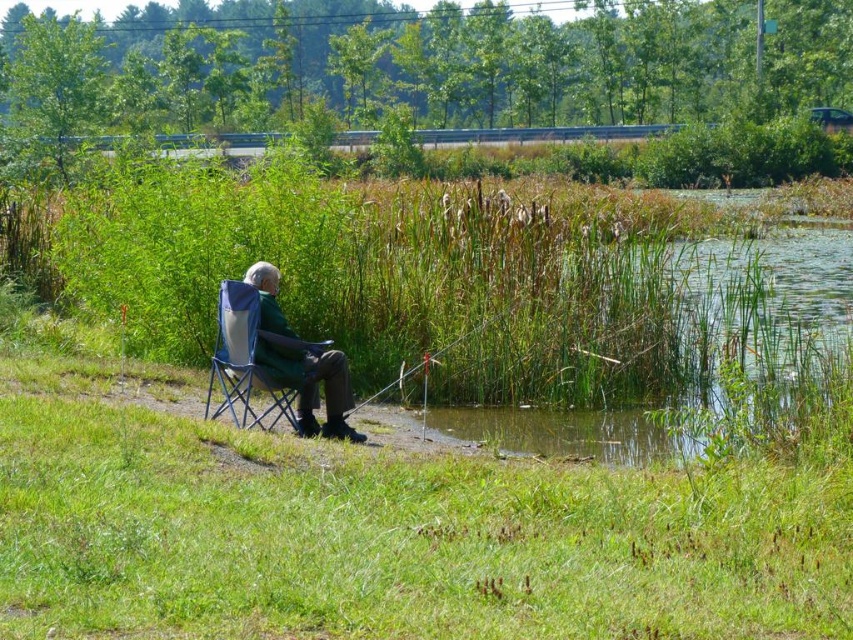
Question: Which object is the closest to the green fabric chair at center?

Choices:
 (A) metallic silver fishing pole at center
 (B) green fabric folding chair at center

Answer: (B)

Question: Can you confirm if green fabric chair at center is positioned below green fabric folding chair at center?

Choices:
 (A) yes
 (B) no

Answer: (B)

Question: Which point is farther to the camera?

Choices:
 (A) green fabric chair at center
 (B) metallic silver fishing pole at center
 (C) green fabric folding chair at center

Answer: (B)

Question: Does green fabric chair at center appear under green fabric folding chair at center?

Choices:
 (A) no
 (B) yes

Answer: (A)

Question: Which point appears closest to the camera in this image?

Choices:
 (A) (228, 305)
 (B) (341, 360)

Answer: (A)

Question: Does green fabric chair at center have a larger size compared to metallic silver fishing pole at center?

Choices:
 (A) yes
 (B) no

Answer: (B)